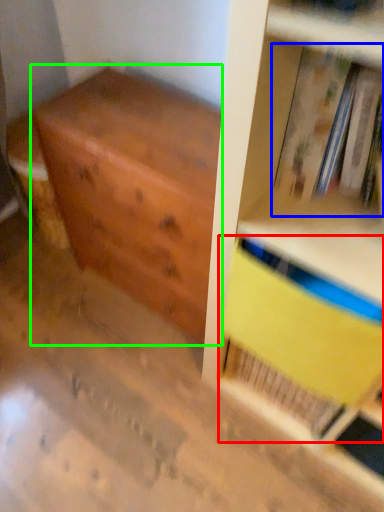
Question: Which object is the farthest from paperback book (highlighted by a red box)? Choose among these: book (highlighted by a blue box) or chest of drawers (highlighted by a green box).

Choices:
 (A) book
 (B) chest of drawers

Answer: (B)